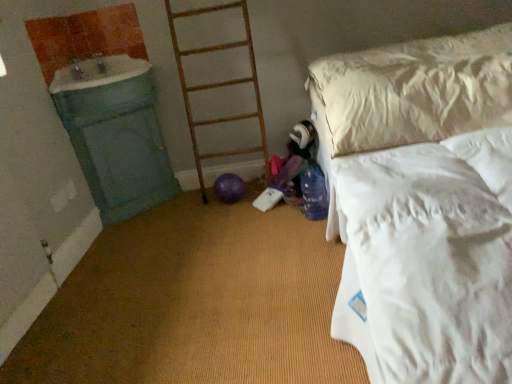
The height and width of the screenshot is (384, 512). What do you see at coordinates (422, 204) in the screenshot? I see `white soft bed at right` at bounding box center [422, 204].

Measure the distance between point (117, 66) and camera.

Point (117, 66) and camera are 8.36 feet apart from each other.

Locate an element on the screen. wooden ladder at center is located at coordinates (218, 86).

Which of these two, white soft bed at right or wooden ladder at center, is bigger?

With larger size is white soft bed at right.

Is white soft bed at right not close to wooden ladder at center?

They are positioned close to each other.

Relative to wooden ladder at center, is white soft bed at right in front or behind?

Visually, white soft bed at right is located in front of wooden ladder at center.

Is white soft bed at right oriented away from wooden ladder at center?

white soft bed at right is not turned away from wooden ladder at center.

From their relative heights in the image, would you say green painted wood sink at left is taller or shorter than wooden ladder at center?

In the image, green painted wood sink at left appears to be shorter than wooden ladder at center.

Which of these two, green painted wood sink at left or wooden ladder at center, is wider?

green painted wood sink at left.

Can you tell me how much green painted wood sink at left and wooden ladder at center differ in facing direction?

0.00186 degrees.

Which is more to the left, green painted wood sink at left or wooden ladder at center?

Positioned to the left is green painted wood sink at left.

Which of these two, white soft bed at right or green painted wood sink at left, is smaller?

green painted wood sink at left is smaller.

Is point (481, 370) positioned before point (118, 74)?

That is True.

Would you say white soft bed at right is inside or outside green painted wood sink at left?

white soft bed at right is spatially situated outside green painted wood sink at left.

Looking at this image, from a real-world perspective, is wooden ladder at center on top of green painted wood sink at left?

Incorrect, from a real-world perspective, wooden ladder at center is lower than green painted wood sink at left.

Is wooden ladder at center not within green painted wood sink at left?

wooden ladder at center is positioned outside green painted wood sink at left.

From the image's perspective, is wooden ladder at center located above or below green painted wood sink at left?

wooden ladder at center is below green painted wood sink at left.

Is wooden ladder at center looking in the opposite direction of green painted wood sink at left?

No.

Is white soft bed at right surrounded by green painted wood sink at left?

No.

Is green painted wood sink at left in contact with white soft bed at right?

green painted wood sink at left and white soft bed at right are not in contact.

Which object is wider, green painted wood sink at left or white soft bed at right?

With larger width is white soft bed at right.

How much distance is there between green painted wood sink at left and white soft bed at right?

The distance of green painted wood sink at left from white soft bed at right is 4.35 feet.

Consider the image. From their relative heights in the image, would you say wooden ladder at center is taller or shorter than white soft bed at right?

In the image, wooden ladder at center appears to be taller than white soft bed at right.

From the picture: Is wooden ladder at center positioned before white soft bed at right?

No, it is behind white soft bed at right.

The width and height of the screenshot is (512, 384). I want to click on bed in front of the wooden ladder at center, so click(x=422, y=204).

Which of these two, wooden ladder at center or white soft bed at right, is bigger?

white soft bed at right is bigger.

Find the location of a particular element. Image resolution: width=512 pixels, height=384 pixels. ladder above the white soft bed at right (from a real-world perspective) is located at coordinates (218, 86).

At what (x,y) coordinates should I click in order to perform the action: click on sink that appears in front of the wooden ladder at center. Please return your answer as a coordinate pair (x, y). The height and width of the screenshot is (384, 512). Looking at the image, I should click on (98, 73).

From the image, which object appears to be farther from wooden ladder at center, green painted wood sink at left or white soft bed at right?

Based on the image, white soft bed at right appears to be further to wooden ladder at center.

From the image, which object appears to be nearer to white soft bed at right, green painted wood sink at left or wooden ladder at center?

The object closer to white soft bed at right is wooden ladder at center.

From the image, which object appears to be farther from white soft bed at right, wooden ladder at center or green painted wood sink at left?

green painted wood sink at left.

When comparing their distances from green painted wood sink at left, does white soft bed at right or wooden ladder at center seem further?

The object further to green painted wood sink at left is white soft bed at right.

Which object lies further to the anchor point wooden ladder at center, white soft bed at right or green painted wood sink at left?

white soft bed at right is further to wooden ladder at center.

When comparing their distances from green painted wood sink at left, does wooden ladder at center or white soft bed at right seem closer?

wooden ladder at center lies closer to green painted wood sink at left than the other object.

At what (x,y) coordinates should I click in order to perform the action: click on ladder between green painted wood sink at left and white soft bed at right from left to right. Please return your answer as a coordinate pair (x, y). This screenshot has height=384, width=512. Looking at the image, I should click on (218, 86).